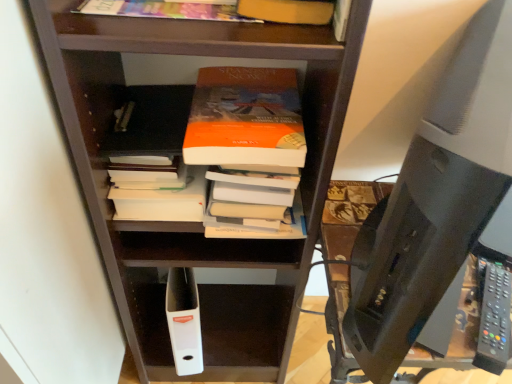
Identify the location of free space to the left of black plastic remote at lower right. The width and height of the screenshot is (512, 384). click(x=425, y=321).